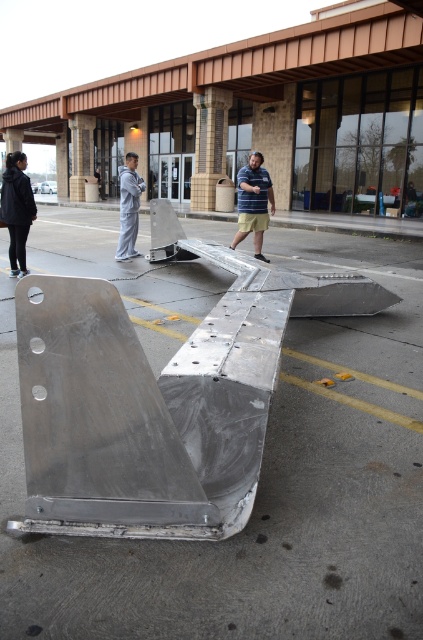
Question: Estimate the real-world distances between objects in this image. Which object is closer to the striped shirt at center?

Choices:
 (A) black matte jacket at left
 (B) silver metallic ramp at center

Answer: (B)

Question: Does black matte jacket at left lie behind gray fabric pants at center?

Choices:
 (A) no
 (B) yes

Answer: (A)

Question: Can you confirm if black matte jacket at left is wider than gray fabric pants at center?

Choices:
 (A) yes
 (B) no

Answer: (B)

Question: Which point appears farthest from the camera in this image?

Choices:
 (A) [x=291, y=580]
 (B) [x=131, y=152]

Answer: (B)

Question: Which object is the closest to the silver metallic ramp at center?

Choices:
 (A) striped shirt at center
 (B) gray fabric pants at center

Answer: (A)

Question: Can you confirm if black matte jacket at left is bigger than striped shirt at center?

Choices:
 (A) no
 (B) yes

Answer: (B)